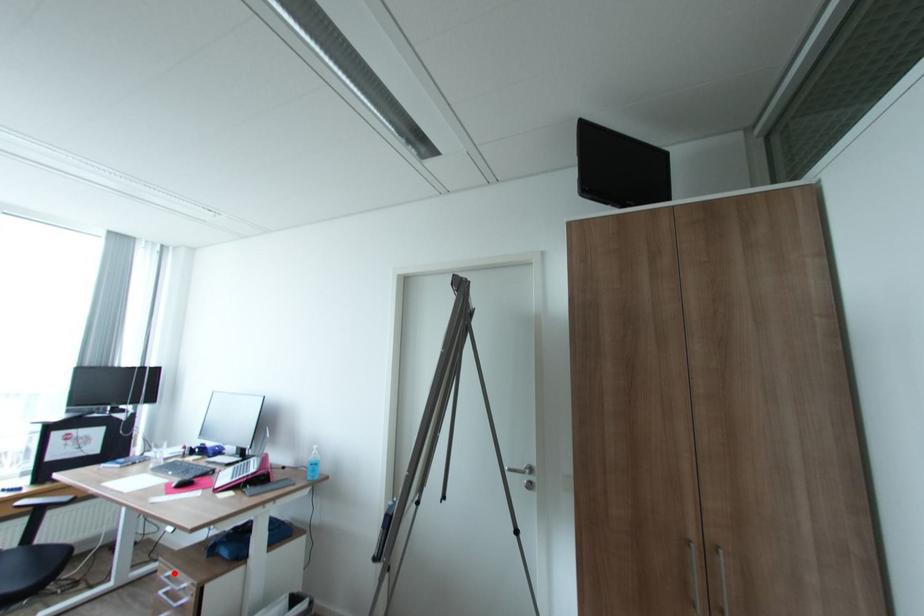
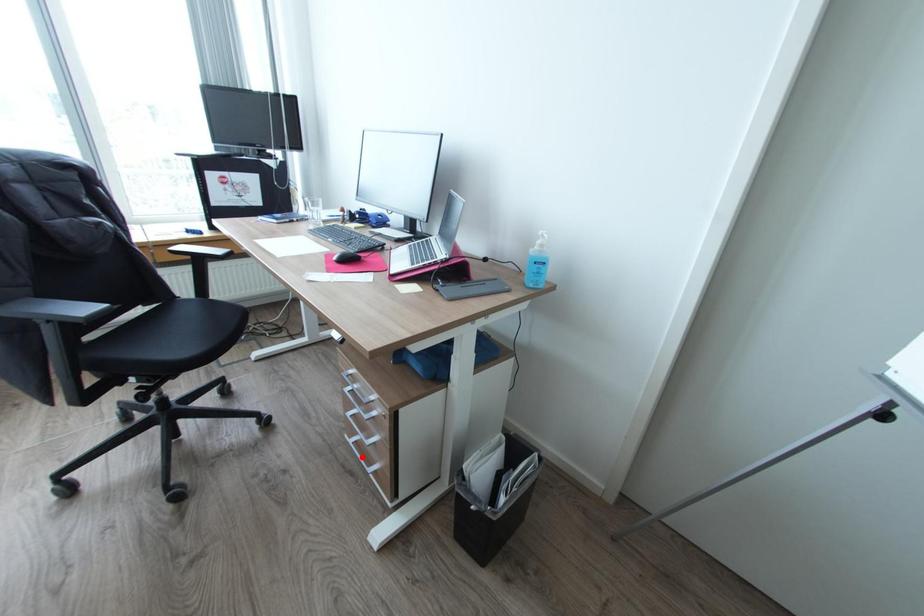
I am providing you with two images of the same scene from different viewpoints. A red point is marked on the first image and another point is marked on the second image. Is the marked point in image1 the same physical position as the marked point in image2?

No